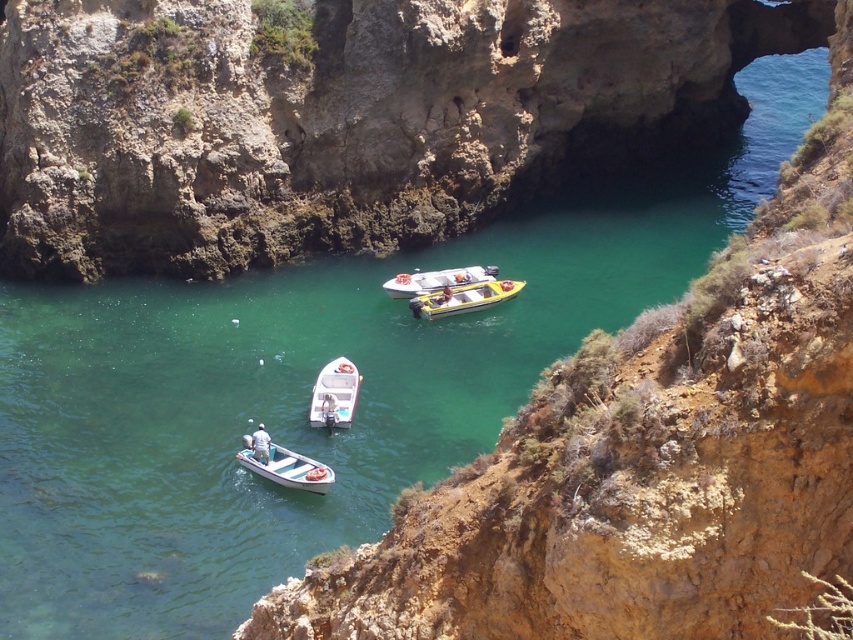
From the picture: Between clear water at center and white fabric shirt at lower center, which one appears on the left side from the viewer's perspective?

From the viewer's perspective, white fabric shirt at lower center appears more on the left side.

Consider the image. Is clear water at center thinner than white fabric shirt at lower center?

In fact, clear water at center might be wider than white fabric shirt at lower center.

Between point (94, 493) and point (254, 449), which one is positioned in front?

Point (94, 493) is more forward.

At what (x,y) coordinates should I click in order to perform the action: click on clear water at center. Please return your answer as a coordinate pair (x, y). This screenshot has width=853, height=640. Looking at the image, I should click on (283, 404).

Who is more forward, (349, 403) or (444, 285)?

Positioned in front is point (349, 403).

Measure the distance between white plastic boat at center and yellow plastic boat at center.

They are 47.49 feet apart.

I want to click on white plastic boat at center, so click(334, 394).

What do you see at coordinates (283, 404) in the screenshot?
I see `clear water at center` at bounding box center [283, 404].

Is clear water at center above white plastic boat at lower center?

Yes.

In order to click on clear water at center in this screenshot , I will do `click(283, 404)`.

What are the coordinates of `clear water at center` in the screenshot? It's located at (283, 404).